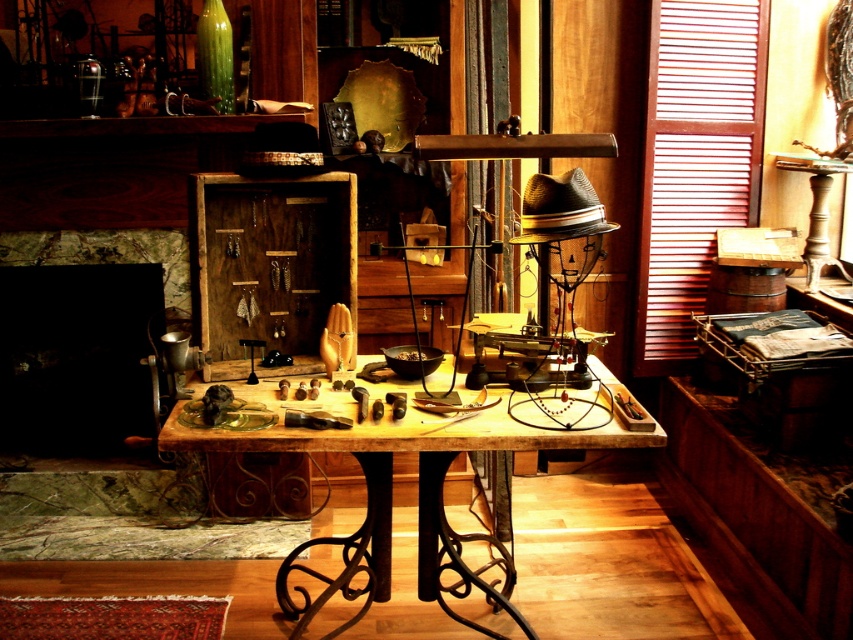
Question: Does black matte fireplace at lower left come in front of wooden table at center?

Choices:
 (A) yes
 (B) no

Answer: (B)

Question: Can you confirm if black matte fireplace at lower left is positioned below wooden table at center?

Choices:
 (A) yes
 (B) no

Answer: (B)

Question: Among these objects, which one is farthest from the camera?

Choices:
 (A) black matte fireplace at lower left
 (B) wooden table at center

Answer: (A)

Question: Which of the following is the farthest from the observer?

Choices:
 (A) wooden table at center
 (B) black matte fireplace at lower left

Answer: (B)

Question: Observing the image, what is the correct spatial positioning of black matte fireplace at lower left in reference to wooden table at center?

Choices:
 (A) below
 (B) above

Answer: (B)

Question: Which point is closer to the camera?

Choices:
 (A) (62, 253)
 (B) (606, 385)

Answer: (B)